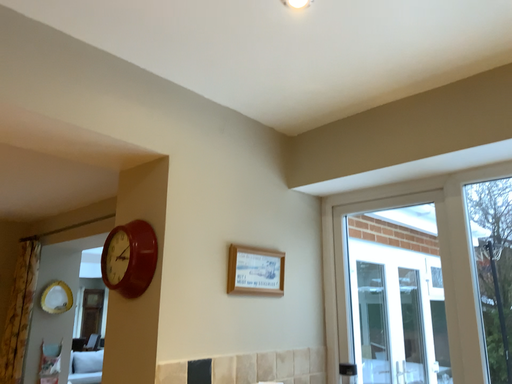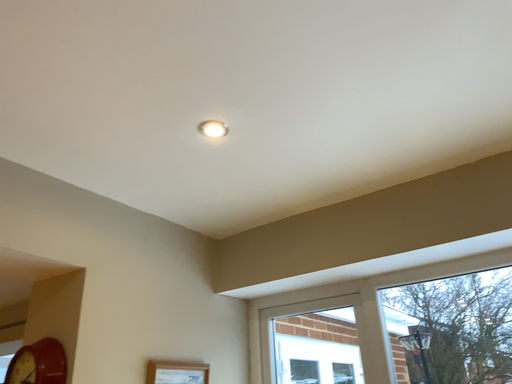
Question: Which way did the camera rotate in the video?

Choices:
 (A) rotated left
 (B) rotated right

Answer: (B)